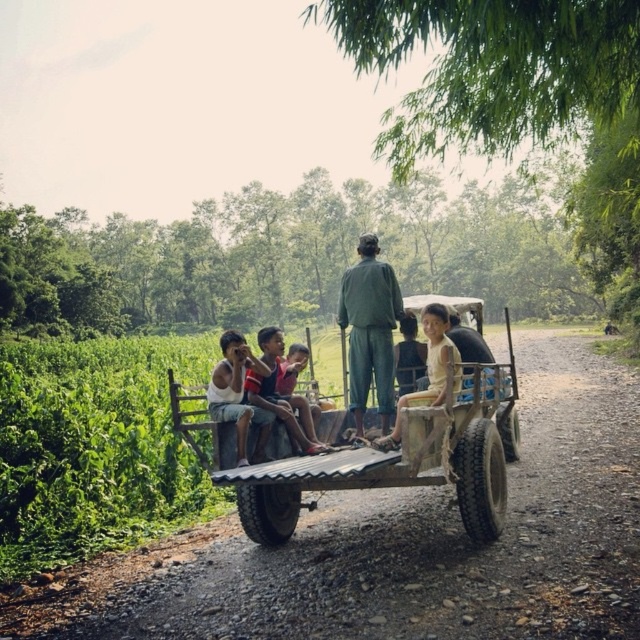
You are a photographer trying to capture a clear shot of the green fabric shirt at center and the light beige fabric shirt at center. Which shirt should you focus on if you want the one that is in front?

The green fabric shirt at center is positioned over light beige fabric shirt at center, so you should focus on the green fabric shirt at center as it is in front.

You are a photographer standing 2 meters away from the wooden cart at center and the light beige fabric shirt at center. You want to take a photo that includes both objects in the frame. Given that your camera has a maximum focus range of 2 meters, will both objects be in focus?

The wooden cart at center and light beige fabric shirt at center are 54.30 centimeters apart from each other. Since both objects are within the 2 meter distance from the photographer, they will both be in focus within the camera range.

You are a traveler who wants to know if the wooden cart at center can fit through a narrow alley that is only as wide as the light beige fabric shirt at center. Can it?

The wooden cart at center is wider than the light beige fabric shirt at center, so it cannot fit through an alley that is only as wide as the light beige fabric shirt at center.